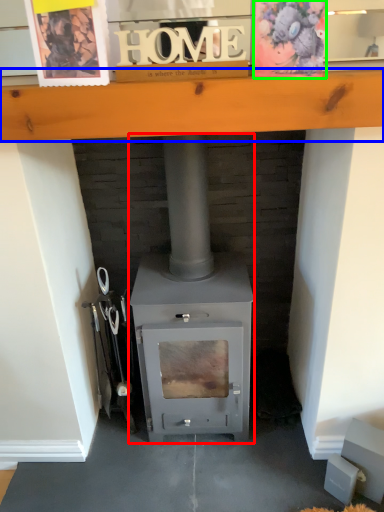
Question: Estimate the real-world distances between objects in this image. Which object is farther from wood burning stove (highlighted by a red box), ledge (highlighted by a blue box) or postcard (highlighted by a green box)?

Choices:
 (A) ledge
 (B) postcard

Answer: (B)